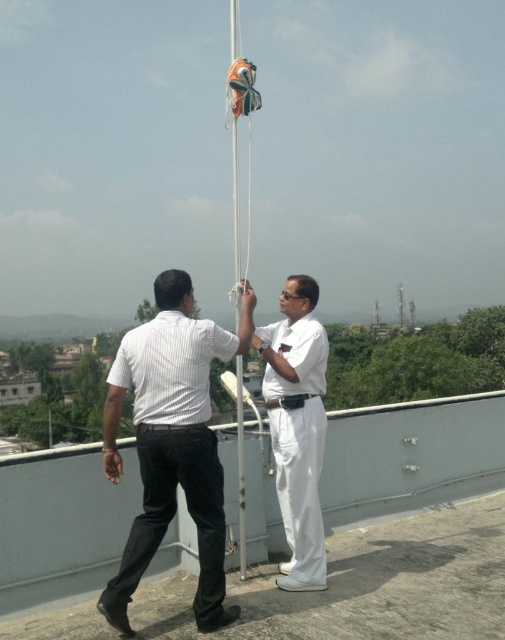
Question: Which point is closer to the camera?

Choices:
 (A) white striped shirt at center
 (B) white glossy sailor at center

Answer: (A)

Question: Does white striped shirt at center have a lesser width compared to white glossy sailor at center?

Choices:
 (A) yes
 (B) no

Answer: (B)

Question: Which of the following is the farthest from the observer?

Choices:
 (A) white glossy sailor at center
 (B) white striped shirt at center

Answer: (A)

Question: Can you confirm if white striped shirt at center is bigger than white glossy sailor at center?

Choices:
 (A) no
 (B) yes

Answer: (B)

Question: Does white striped shirt at center lie in front of white glossy sailor at center?

Choices:
 (A) no
 (B) yes

Answer: (B)